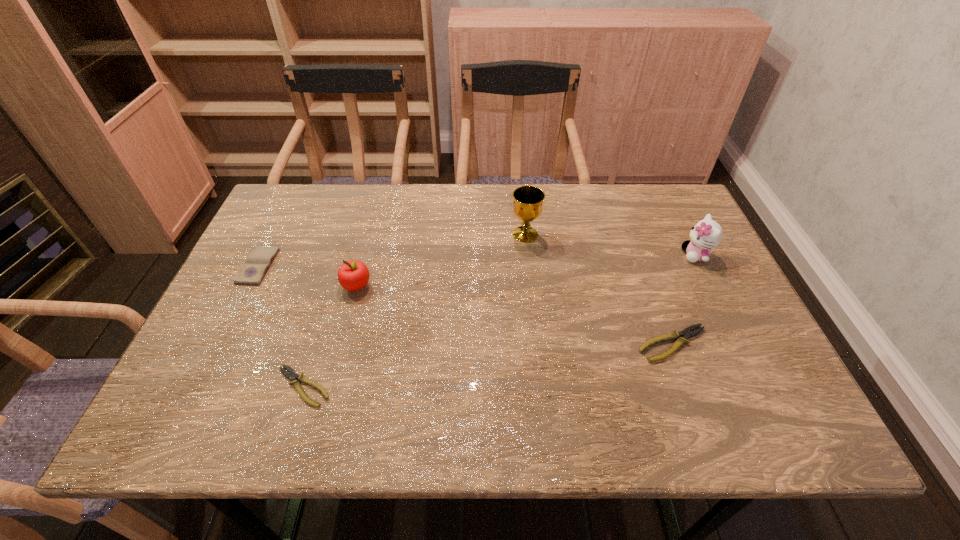
The height and width of the screenshot is (540, 960). What are the coordinates of `free spot located 0.340m on the back of the nearer pliers` in the screenshot? It's located at (344, 258).

This screenshot has width=960, height=540. I want to click on free space located on the left of the fifth farthest object, so click(x=529, y=344).

I want to click on free space located on the front of the leftmost object, so click(x=227, y=329).

The width and height of the screenshot is (960, 540). What are the coordinates of `vacant point located on the back of the apple` in the screenshot? It's located at (372, 226).

The width and height of the screenshot is (960, 540). Find the location of `vacant area situated on the front-facing side of the kitten`. vacant area situated on the front-facing side of the kitten is located at coordinates (538, 255).

What are the coordinates of `free space located on the front-facing side of the kitten` in the screenshot? It's located at (560, 255).

Identify the location of free space located 0.060m on the front-facing side of the kitten. (660, 255).

Identify the location of vacant space located 0.370m on the front of the fourth object from left to right. (539, 357).

At what (x,y) coordinates should I click in order to perform the action: click on object that is at the far edge. Please return your answer as a coordinate pair (x, y). The image size is (960, 540). Looking at the image, I should click on (528, 200).

The width and height of the screenshot is (960, 540). Find the location of `object that is at the left edge`. object that is at the left edge is located at coordinates (252, 272).